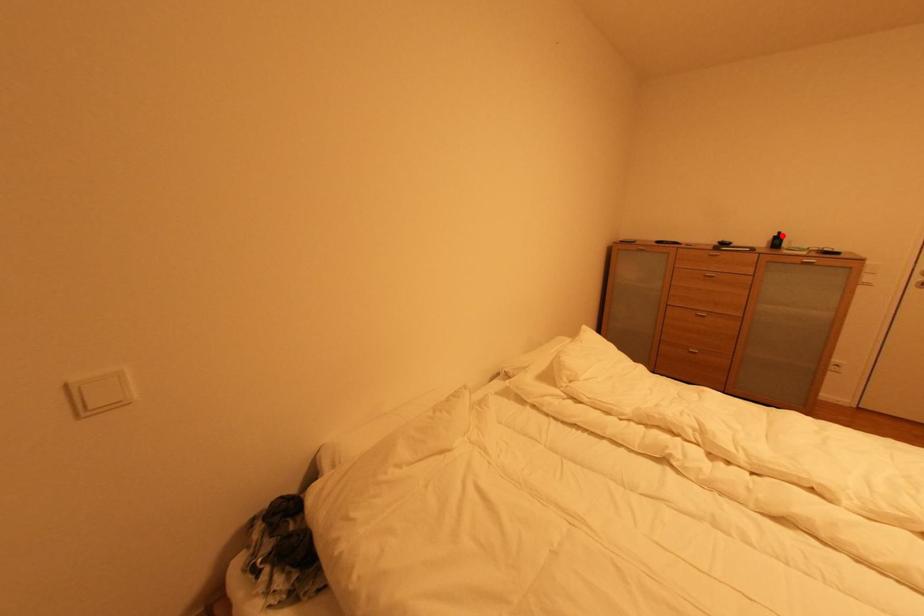
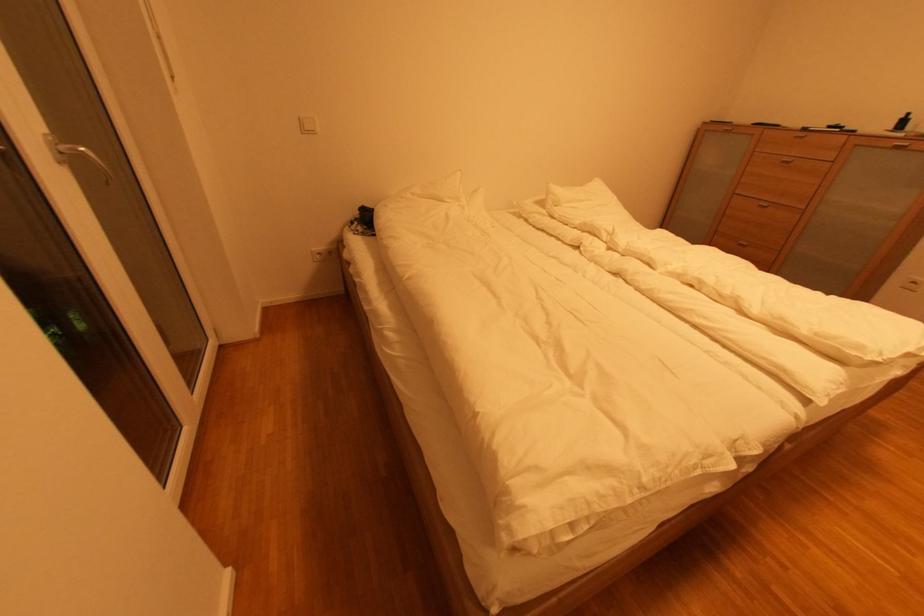
Where in the second image is the point corresponding to the highlighted location from the first image?

(908, 118)